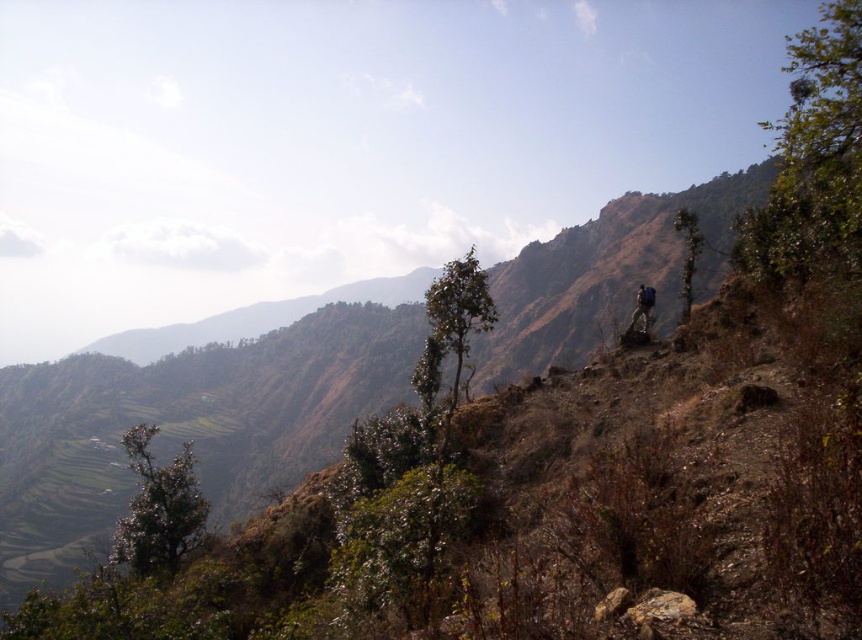
Can you confirm if green leafy tree at upper right is shorter than matte black backpack at upper right?

No.

Does green leafy tree at upper right have a greater width compared to matte black backpack at upper right?

Yes.

Does point (684, 236) lie behind point (642, 320)?

Yes, it is.

Find the location of `green leafy tree at upper right`. green leafy tree at upper right is located at coordinates (688, 256).

Which is below, green leafy tree at lower left or green leafy tree at upper right?

green leafy tree at lower left is below.

Can you confirm if green leafy tree at lower left is positioned to the right of green leafy tree at upper right?

No, green leafy tree at lower left is not to the right of green leafy tree at upper right.

The width and height of the screenshot is (862, 640). What do you see at coordinates (158, 508) in the screenshot?
I see `green leafy tree at lower left` at bounding box center [158, 508].

You are a GUI agent. You are given a task and a screenshot of the screen. Output one action in this format:
    pyautogui.click(x=<x>, y=<y>)
    Task: Click on the green leafy tree at lower left
    
    Given the screenshot: What is the action you would take?
    pyautogui.click(x=158, y=508)

Is green leafy tree at lower left in front of matte black backpack at upper right?

Yes, it is.

Does point (167, 496) come in front of point (642, 284)?

That is True.

The height and width of the screenshot is (640, 862). I want to click on green leafy tree at lower left, so coord(158,508).